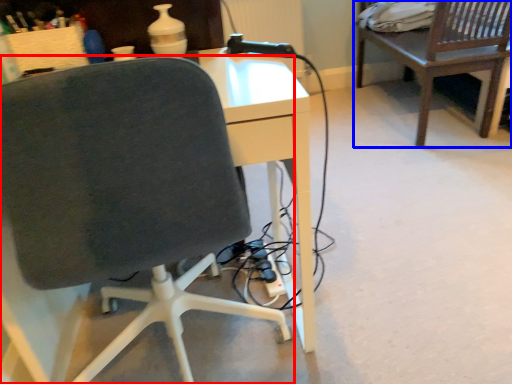
Question: Which of the following is the farthest to the observer, chair (highlighted by a red box) or table (highlighted by a blue box)?

Choices:
 (A) chair
 (B) table

Answer: (B)